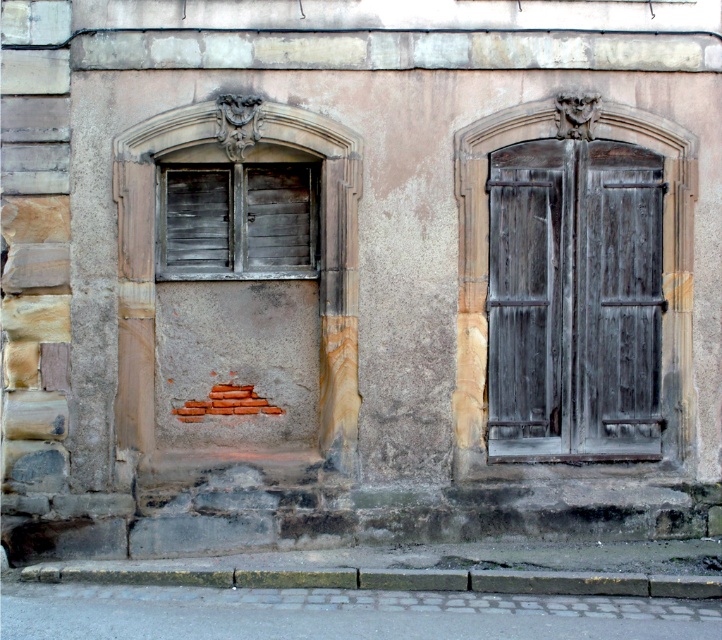
Can you confirm if dark gray wood shutters at center is taller than gray concrete curb at lower center?

Yes.

Consider the image. Does dark gray wood shutters at center appear on the left side of gray concrete curb at lower center?

In fact, dark gray wood shutters at center is to the right of gray concrete curb at lower center.

What are the coordinates of `dark gray wood shutters at center` in the screenshot? It's located at (574, 300).

Where is `dark gray wood shutters at center`? Image resolution: width=722 pixels, height=640 pixels. dark gray wood shutters at center is located at coordinates click(574, 300).

Find the location of a particular element. This screenshot has width=722, height=640. wooden shutters at left is located at coordinates (238, 220).

Is point (168, 209) closer to viewer compared to point (108, 577)?

No, (168, 209) is further to viewer.

Where is `wooden shutters at left`? Image resolution: width=722 pixels, height=640 pixels. wooden shutters at left is located at coordinates (238, 220).

The height and width of the screenshot is (640, 722). I want to click on dark gray wood shutters at center, so click(x=574, y=300).

Where is `dark gray wood shutters at center`? dark gray wood shutters at center is located at coordinates (574, 300).